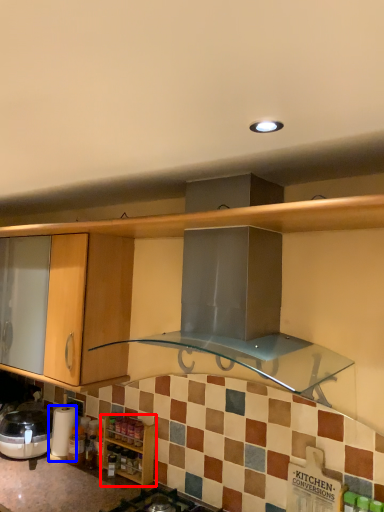
Question: Which object is further to the camera taking this photo, cabinetry (highlighted by a red box) or appliance (highlighted by a blue box)?

Choices:
 (A) cabinetry
 (B) appliance

Answer: (B)